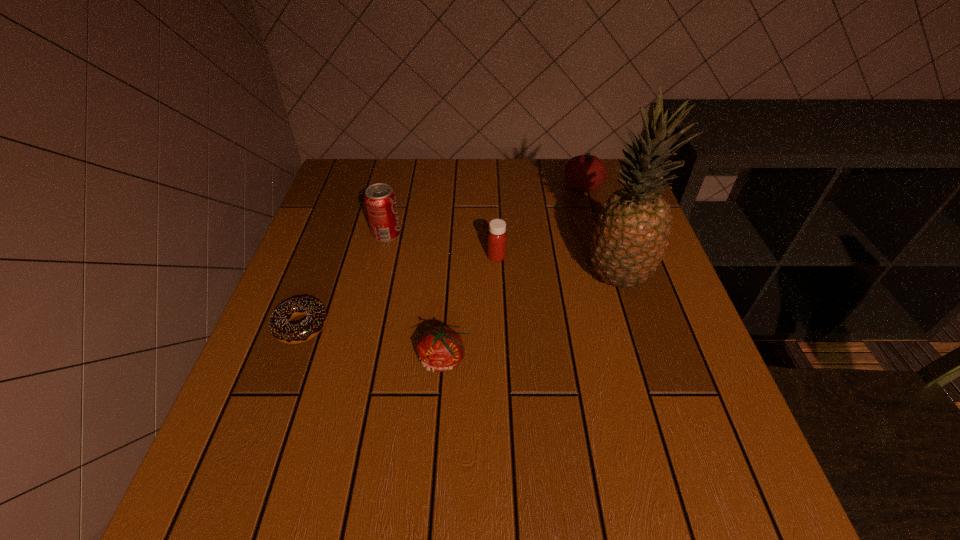
Where is `free space between the medicine and the farthest object`? This screenshot has height=540, width=960. free space between the medicine and the farthest object is located at coordinates (540, 222).

Find the location of a particular element. The image size is (960, 540). free space between the tallest object and the leftmost object is located at coordinates (459, 302).

The height and width of the screenshot is (540, 960). What are the coordinates of `free area in between the medicine and the shortest object` in the screenshot? It's located at (398, 292).

The height and width of the screenshot is (540, 960). What are the coordinates of `free space between the pineapple and the medicine` in the screenshot? It's located at pyautogui.click(x=557, y=267).

Where is `empty space that is in between the third object from left to right and the right tomato`? The width and height of the screenshot is (960, 540). empty space that is in between the third object from left to right and the right tomato is located at coordinates (514, 273).

The height and width of the screenshot is (540, 960). I want to click on free spot between the shortest object and the farthest object, so click(442, 256).

This screenshot has height=540, width=960. I want to click on free space between the tallest object and the medicine, so click(557, 267).

What are the coordinates of `vacant point located between the fourth object from left to right and the pineapple` in the screenshot? It's located at (557, 267).

You are a GUI agent. You are given a task and a screenshot of the screen. Output one action in this format:
    pyautogui.click(x=<x>, y=<y>)
    Task: Click on the object that is the third closest to the medicine
    Image resolution: width=960 pixels, height=540 pixels.
    Given the screenshot: What is the action you would take?
    pyautogui.click(x=440, y=349)

Point out which object is positioned as the nearest to the third object from right to left. Please provide its 2D coordinates. Your answer should be formatted as a tuple, i.e. [(x, y)], where the tuple contains the x and y coordinates of a point satisfying the conditions above.

[(628, 243)]